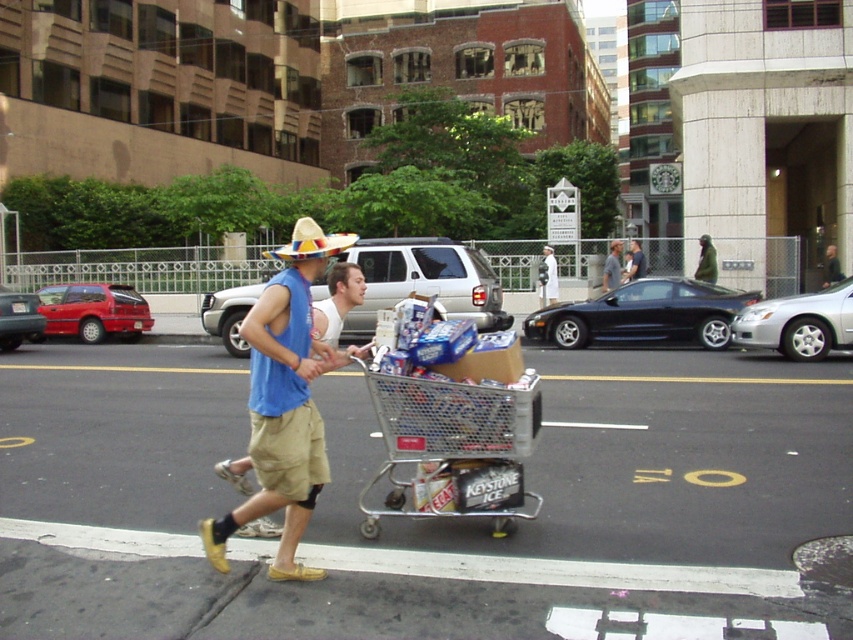
Question: Which point is closer to the camera taking this photo?

Choices:
 (A) (637, 262)
 (B) (294, 417)
 (C) (613, 241)

Answer: (B)

Question: Does multicolored woven straw hat at center appear over dark brown leather jacket at upper right?

Choices:
 (A) no
 (B) yes

Answer: (B)

Question: Which object is farther from the camera taking this photo?

Choices:
 (A) metallic silver shopping cart at center
 (B) multicolored woven straw hat at center
 (C) white cotton shirt at center

Answer: (C)

Question: Is metallic silver shopping cart at center above dark brown leather jacket at upper right?

Choices:
 (A) yes
 (B) no

Answer: (B)

Question: Can you confirm if white cotton shirt at center is positioned below blue t-shirt at center?

Choices:
 (A) no
 (B) yes

Answer: (B)

Question: Which is farther from the white cotton shirt at center?

Choices:
 (A) blue t-shirt at center
 (B) metallic silver shopping cart at center
 (C) dark brown leather jacket at upper right
 (D) green fuzzy jacket at center

Answer: (B)